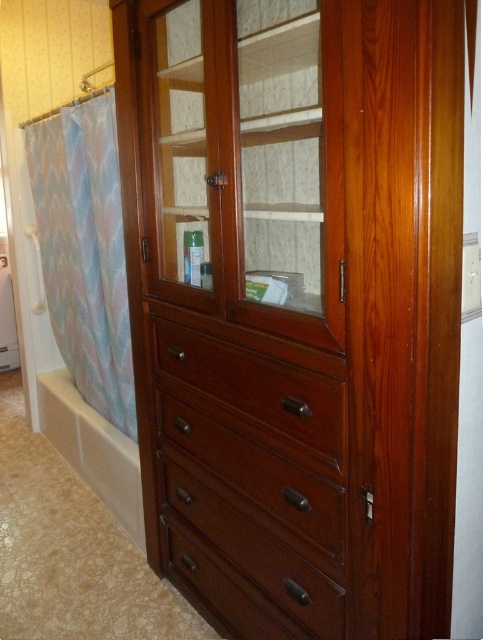
Looking at this image, you are standing in the bathroom and need to place a small plant on the floor. The plant requires a spot that is not directly under any cabinets or drawers to avoid blocking airflow. Based on the image, is the point at coordinates point (254, 474) suitable for placing the plant?

The dark wood drawer at center is represented by point (254, 474), so placing the plant there would be directly under the drawer, which blocks airflow. Choose another spot.

You are a home inspector assessing the bathroom layout. You need to check the condition of the white glossy bathtub at lower left but the polished wood armoire at center is blocking your view. Can you move the armoire to access the bathtub?

The polished wood armoire at center is in front of the white glossy bathtub at lower left, so moving the armoire would allow you to access and inspect the bathtub.